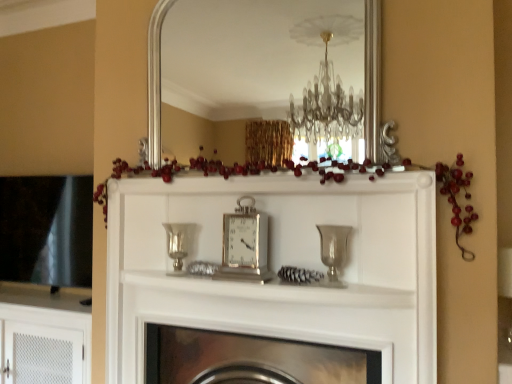
Question: Would you say silver metallic vase at center, arranged as the 1th candle holder when viewed from the left, is to the left or to the right of silver/metallic mirror at upper center in the picture?

Choices:
 (A) left
 (B) right

Answer: (A)

Question: Is silver metallic vase at center, which is counted as the 2th candle holder, starting from the front, wider or thinner than silver/metallic mirror at upper center?

Choices:
 (A) thin
 (B) wide

Answer: (B)

Question: Considering the real-world distances, which object is closest to the silver/metallic clock at center?

Choices:
 (A) white textured cabinet at lower left
 (B) silver metallic vase at center, which is the second candle holder in right-to-left order
 (C) silver/metallic mirror at upper center
 (D) metallic silver fireplace at center
 (E) clear glass vase at center, which is the 2th candle holder in left-to-right order

Answer: (B)

Question: Estimate the real-world distances between objects in this image. Which object is farther from the silver/metallic mirror at upper center?

Choices:
 (A) white textured cabinet at lower left
 (B) metallic silver fireplace at center
 (C) silver metallic vase at center, which is counted as the 2th candle holder, starting from the front
 (D) silver/metallic clock at center
 (E) clear glass vase at center, placed as the first candle holder when sorted from right to left

Answer: (B)